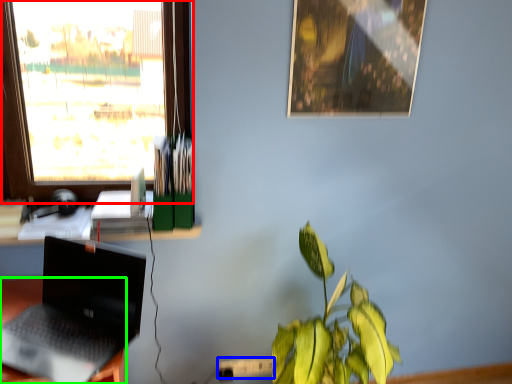
Question: Based on their relative distances, which object is nearer to window (highlighted by a red box)? Choose from power outlet (highlighted by a blue box) and desk (highlighted by a green box).

Choices:
 (A) power outlet
 (B) desk

Answer: (B)